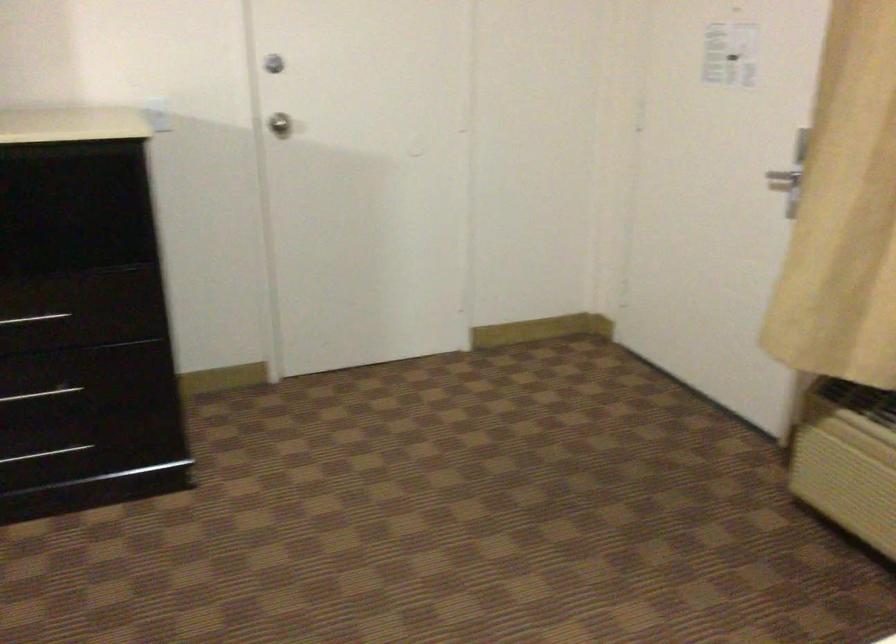
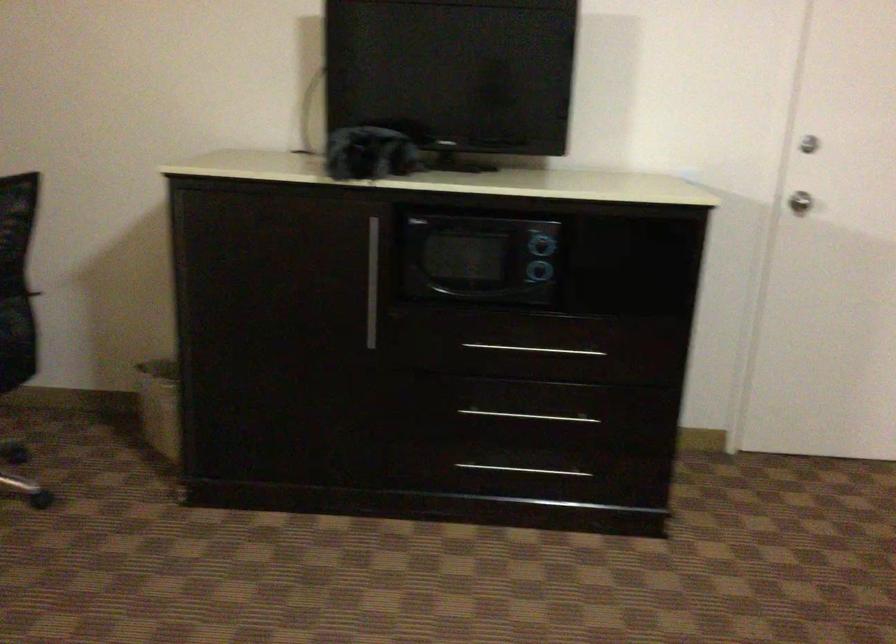
Question: The first image is from the beginning of the video and the second image is from the end. How did the camera likely rotate when shooting the video?

Choices:
 (A) Left
 (B) Right
 (C) Up
 (D) Down

Answer: (A)